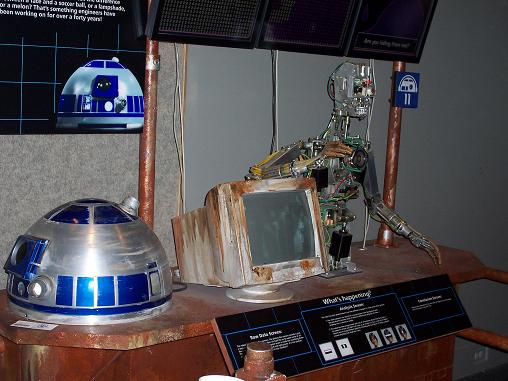
At what (x,y) coordinates should I click in order to perform the action: click on outlet. Please return your answer as a coordinate pair (x, y). Looking at the image, I should click on (483, 352).